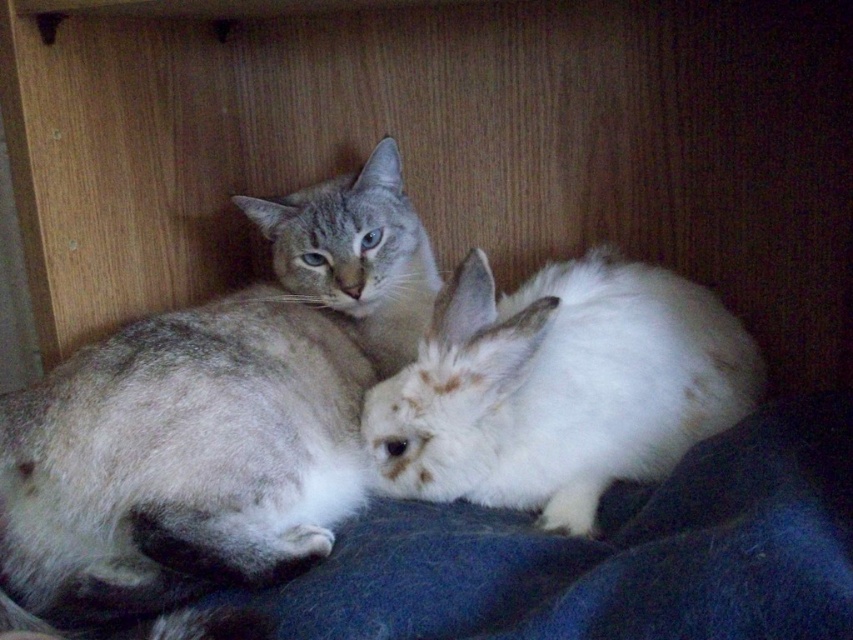
Locate an element on the screen. gray fur cat at upper left is located at coordinates (216, 417).

Is point (64, 573) closer to viewer compared to point (576, 332)?

Yes, it is in front of point (576, 332).

Is point (393, 195) closer to camera compared to point (492, 500)?

No.

Identify the location of gray fur cat at upper left. This screenshot has width=853, height=640. (216, 417).